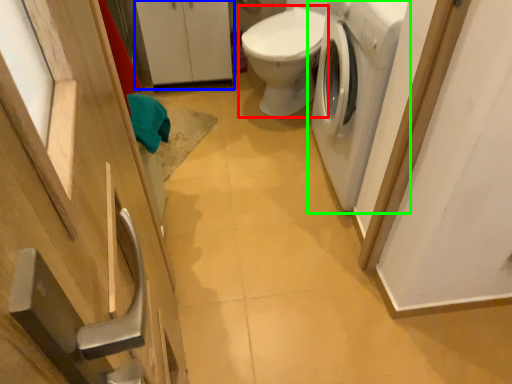
Question: Which object is positioned closest to toilet (highlighted by a red box)? Select from cabinetry (highlighted by a blue box) and washing machine (highlighted by a green box).

Choices:
 (A) cabinetry
 (B) washing machine

Answer: (B)